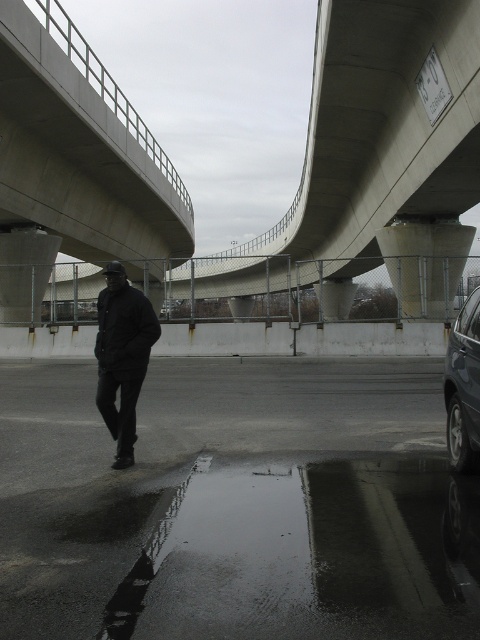
Question: Among these points, which one is farthest from the camera?

Choices:
 (A) (92, 632)
 (B) (349, 164)

Answer: (B)

Question: Is black matte jacket at center closer to the viewer compared to shiny black suv at right?

Choices:
 (A) yes
 (B) no

Answer: (B)

Question: Which object appears farthest from the camera in this image?

Choices:
 (A) concrete at center
 (B) black matte jacket at center
 (C) glossy asphalt highway at lower left
 (D) shiny black suv at right

Answer: (A)

Question: Which object is closer to the camera taking this photo?

Choices:
 (A) concrete at center
 (B) black matte jacket at center

Answer: (B)

Question: Is concrete at center further to the viewer compared to shiny black suv at right?

Choices:
 (A) yes
 (B) no

Answer: (A)

Question: Is glossy asphalt highway at lower left wider than black matte jacket at center?

Choices:
 (A) yes
 (B) no

Answer: (A)